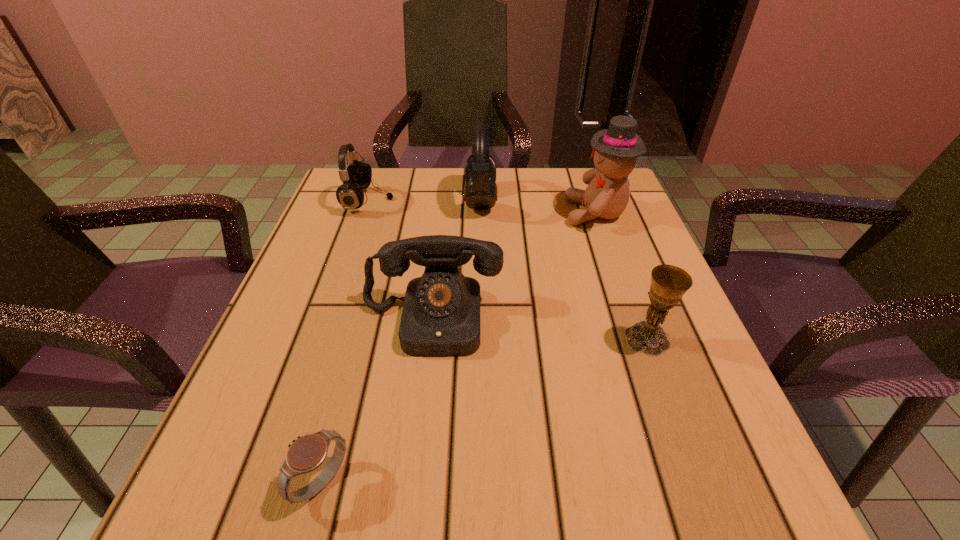
Find the location of a particular element. This screenshot has height=540, width=960. telephone that is at the left edge is located at coordinates (441, 313).

Where is `headset that is at the left edge`? The height and width of the screenshot is (540, 960). headset that is at the left edge is located at coordinates 358,175.

Image resolution: width=960 pixels, height=540 pixels. Identify the location of watch positioned at the left edge. (307, 453).

Identify the location of rag_doll that is positioned at the right edge. (615, 150).

At what (x,y) coordinates should I click in order to perform the action: click on chalice at the right edge. Please return your answer as a coordinate pair (x, y). Looking at the image, I should click on (669, 283).

Locate an element on the screen. This screenshot has height=540, width=960. object positioned at the far left corner is located at coordinates (358, 175).

You are a GUI agent. You are given a task and a screenshot of the screen. Output one action in this format:
    pyautogui.click(x=<x>, y=<y>)
    Task: Click on the object that is positioned at the near left corner
    Image resolution: width=960 pixels, height=540 pixels.
    Given the screenshot: What is the action you would take?
    pyautogui.click(x=307, y=453)

In order to click on object present at the far right corner in this screenshot , I will do `click(615, 150)`.

Locate an element on the screen. free space at the far edge of the desktop is located at coordinates (549, 204).

The image size is (960, 540). In the image, there is a desktop. Find the location of `vacant space at the near edge`. vacant space at the near edge is located at coordinates (597, 511).